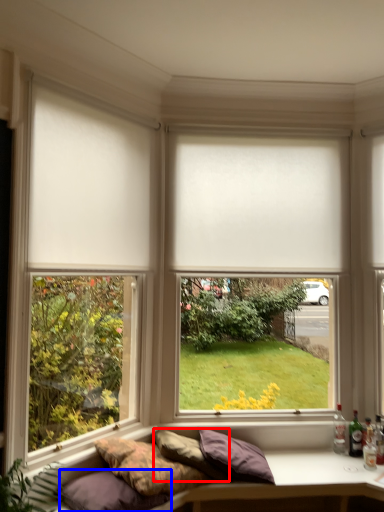
Question: Which object is further to the camera taking this photo, pillow (highlighted by a red box) or pillow (highlighted by a blue box)?

Choices:
 (A) pillow
 (B) pillow

Answer: (A)